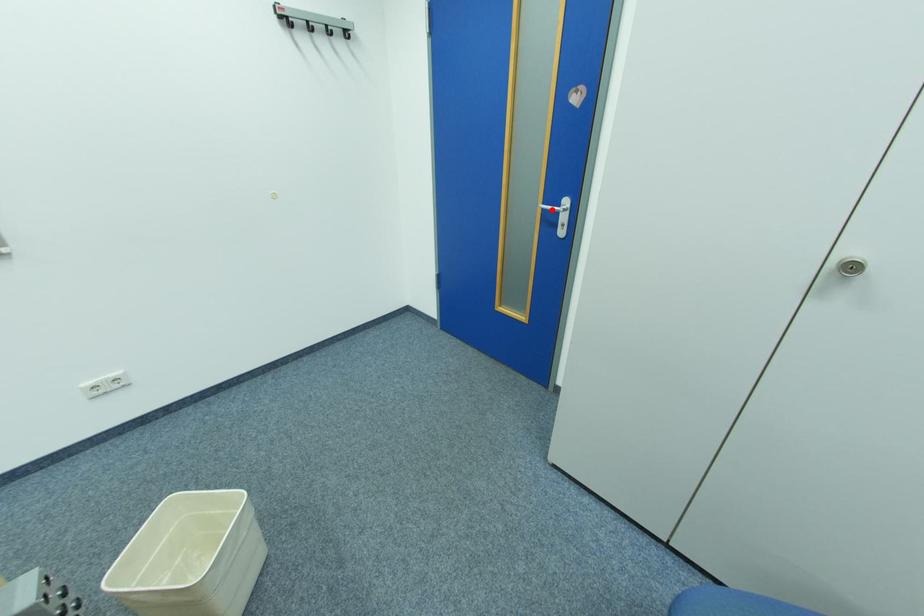
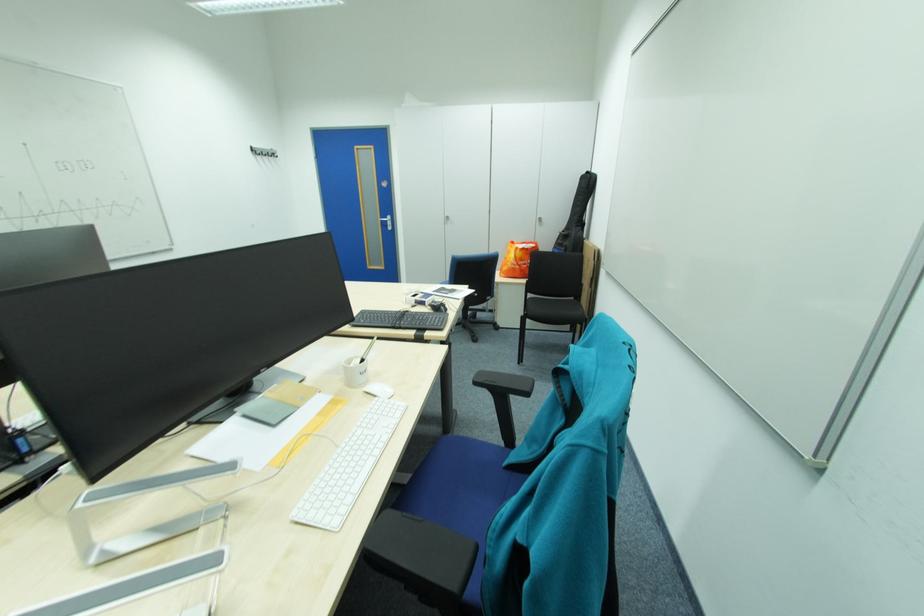
Where in the second image is the point corresponding to the highlighted location from the first image?

(390, 221)